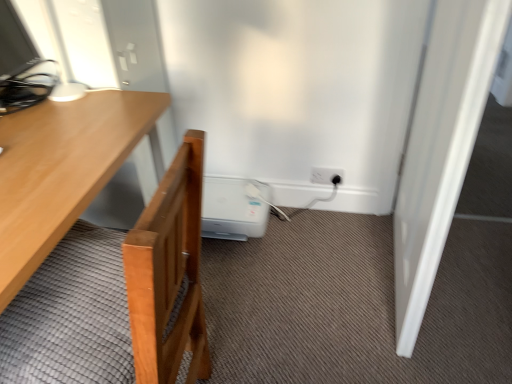
Image resolution: width=512 pixels, height=384 pixels. What are the coordinates of `vacant space to the right of white plastic water heater at lower center` in the screenshot? It's located at (301, 238).